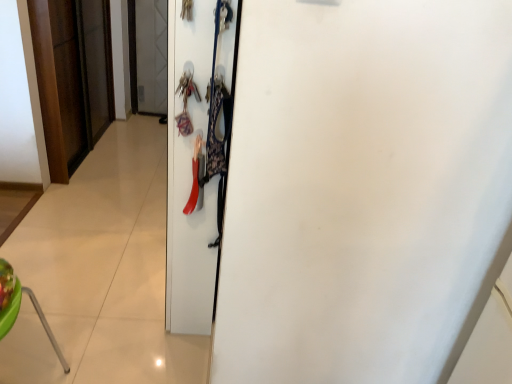
Question: Can you confirm if wooden door at left, which is the 1th door in back-to-front order, is taller than white matte door at center, which is the first door in right-to-left order?

Choices:
 (A) yes
 (B) no

Answer: (B)

Question: Is wooden door at left, the 2th door positioned from the right, facing towards white matte door at center, which ranks as the second door in back-to-front order?

Choices:
 (A) yes
 (B) no

Answer: (B)

Question: Considering the relative sizes of wooden door at left, the 2th door positioned from the right, and white matte door at center, the 1th door viewed from the front, in the image provided, is wooden door at left, the 2th door positioned from the right, bigger than white matte door at center, the 1th door viewed from the front,?

Choices:
 (A) no
 (B) yes

Answer: (A)

Question: From a real-world perspective, is wooden door at left, which is the first door in left-to-right order, under white matte door at center, which is the first door in right-to-left order?

Choices:
 (A) yes
 (B) no

Answer: (A)

Question: From the image's perspective, would you say wooden door at left, which is the 1th door in back-to-front order, is shown under white matte door at center, which is counted as the second door, starting from the left?

Choices:
 (A) no
 (B) yes

Answer: (A)

Question: From a real-world perspective, does wooden door at left, which is the 1th door in back-to-front order, stand above white matte door at center, which is counted as the second door, starting from the left?

Choices:
 (A) no
 (B) yes

Answer: (A)

Question: Is white matte door at center, which ranks as the second door in back-to-front order, looking in the opposite direction of wooden door at left, which is the first door in left-to-right order?

Choices:
 (A) no
 (B) yes

Answer: (A)

Question: Does white matte door at center, which ranks as the second door in back-to-front order, have a greater height compared to wooden door at left, which is the first door in left-to-right order?

Choices:
 (A) yes
 (B) no

Answer: (A)

Question: Considering the relative positions of white matte door at center, which ranks as the second door in back-to-front order, and wooden door at left, which is the first door in left-to-right order, in the image provided, is white matte door at center, which ranks as the second door in back-to-front order, behind wooden door at left, which is the first door in left-to-right order,?

Choices:
 (A) no
 (B) yes

Answer: (A)

Question: Are white matte door at center, which is the first door in right-to-left order, and wooden door at left, which is the first door in left-to-right order, beside each other?

Choices:
 (A) yes
 (B) no

Answer: (B)

Question: Can you confirm if white matte door at center, the 1th door viewed from the front, is smaller than wooden door at left, which ranks as the second door in front-to-back order?

Choices:
 (A) yes
 (B) no

Answer: (B)

Question: Can you confirm if white matte door at center, the 1th door viewed from the front, is wider than wooden door at left, which is the first door in left-to-right order?

Choices:
 (A) no
 (B) yes

Answer: (B)

Question: Is white matte door at center, which ranks as the second door in back-to-front order, bigger or smaller than wooden door at left, which is the 1th door in back-to-front order?

Choices:
 (A) big
 (B) small

Answer: (A)